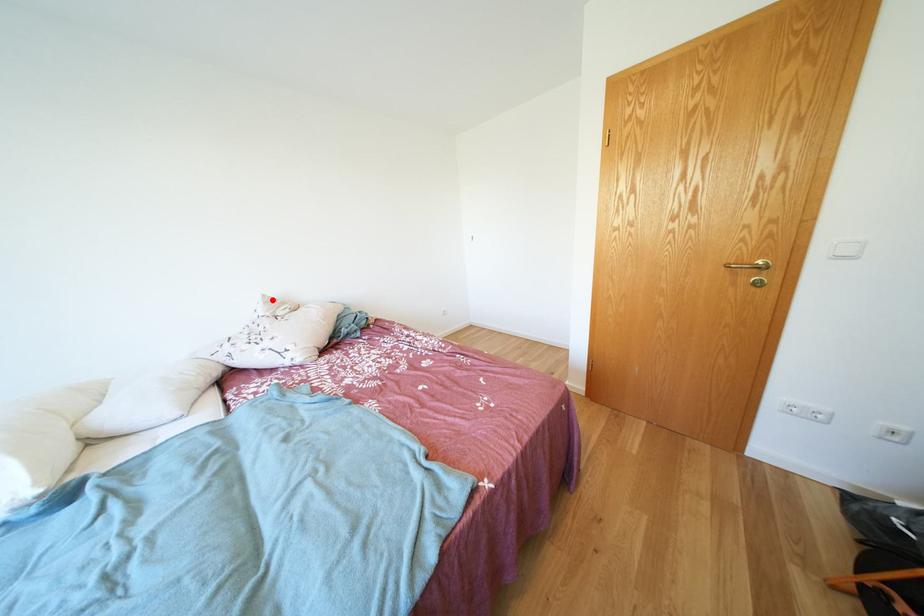
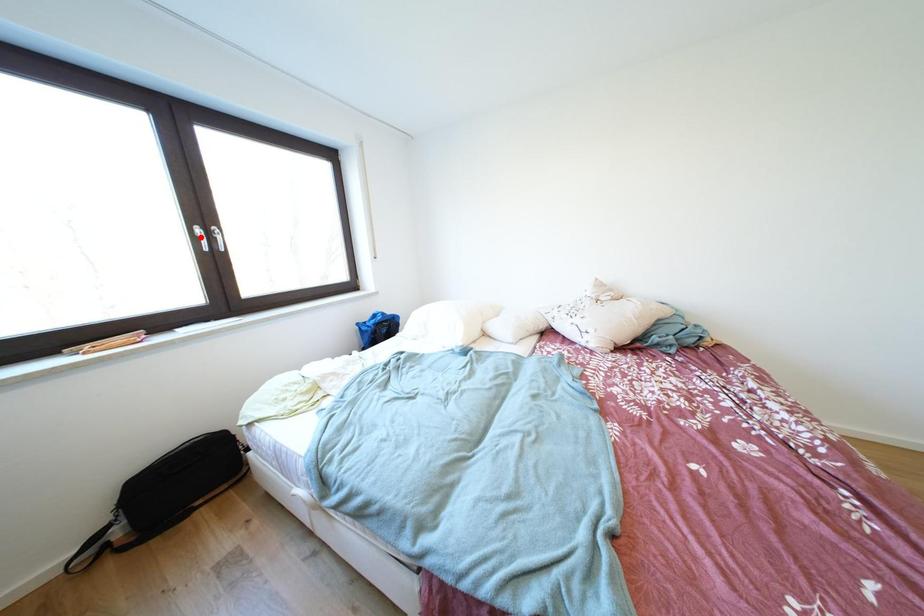
I am providing you with two images of the same scene from different viewpoints. A red point is marked on the first image and another point is marked on the second image. Are the points marked in image1 and image2 representing the same 3D position?

No